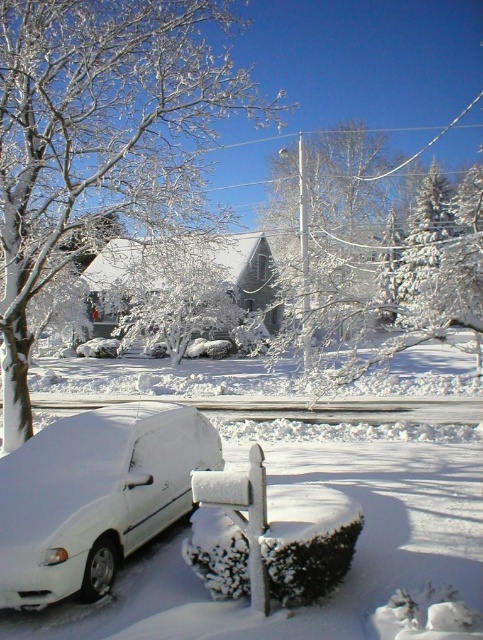
You are a snowplow operator who needs to clear the snow from the driveway. You see the white fluffy snow at lower left and the white matte car at lower left. Which area should you clear first to ensure the car can exit safely?

You should clear the white fluffy snow at lower left first because it is wider than the white matte car at lower left, so it might block the car from exiting safely.